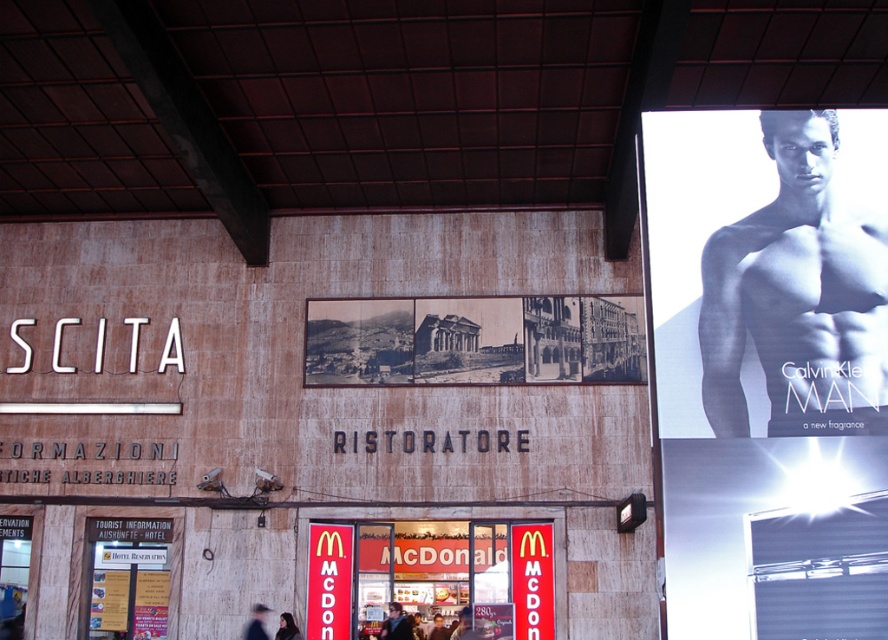
You are standing in front of the building and want to touch both points mentioned. Which point should you reach for first, the point at coordinates point (338,608) or the point at coordinates point (401,628)?

You should reach for point (338,608) first because it is closer to you than point (401,628).